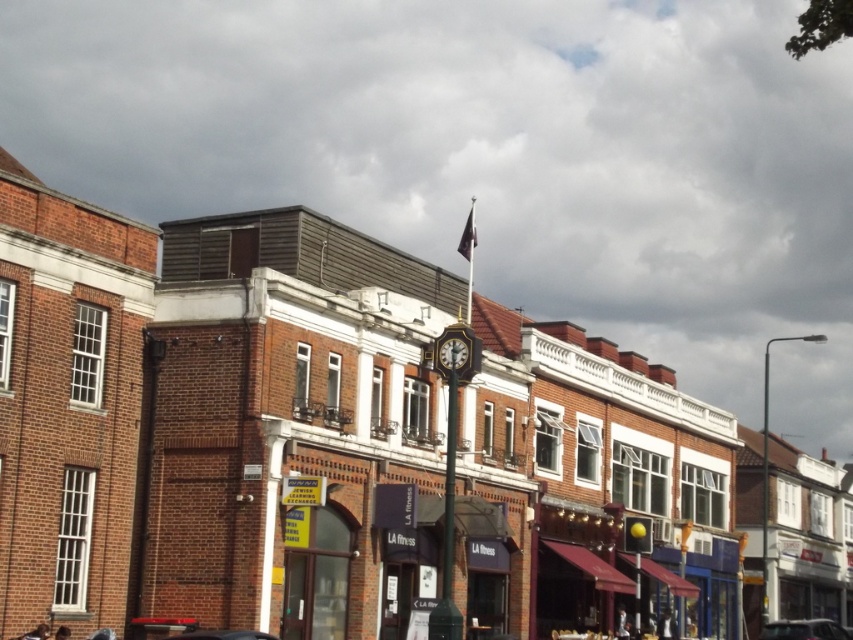
Question: Is metallic silver car at lower right positioned in front of gold metallic clock at center?

Choices:
 (A) yes
 (B) no

Answer: (B)

Question: Among these points, which one is nearest to the camera?

Choices:
 (A) (461, 365)
 (B) (781, 620)

Answer: (A)

Question: Can you confirm if metallic silver car at lower right is thinner than gold metallic clock at center?

Choices:
 (A) yes
 (B) no

Answer: (B)

Question: Which object appears closest to the camera in this image?

Choices:
 (A) gold metallic clock at center
 (B) metallic silver car at lower right

Answer: (A)

Question: Among these objects, which one is farthest from the camera?

Choices:
 (A) metallic silver car at lower right
 (B) gold metallic clock at center

Answer: (A)

Question: Is metallic silver car at lower right bigger than gold metallic clock at center?

Choices:
 (A) yes
 (B) no

Answer: (A)